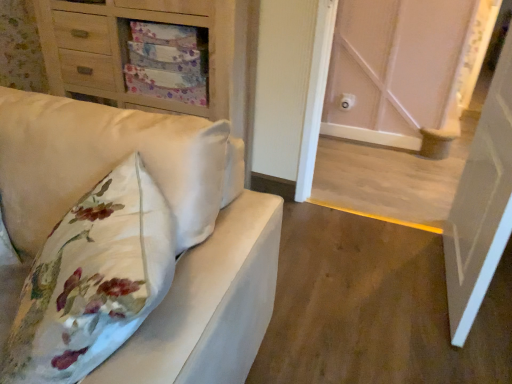
Question: From a real-world perspective, is white wood door at center, arranged as the 1th door when viewed from the back, physically located above or below white glossy door at right, which ranks as the 2th door in back-to-front order?

Choices:
 (A) above
 (B) below

Answer: (B)

Question: In the image, is white wood door at center, the second door in the front-to-back sequence, on the left side or the right side of white glossy door at right, which ranks as the 2th door in back-to-front order?

Choices:
 (A) left
 (B) right

Answer: (A)

Question: Which of these objects is positioned closest to the matte wood chest of drawers at upper left?

Choices:
 (A) white wood door at center, arranged as the 1th door when viewed from the back
 (B) matte white sofa at left
 (C) white glossy door at right, which ranks as the 2th door in back-to-front order

Answer: (B)

Question: Considering the real-world distances, which object is closest to the matte wood chest of drawers at upper left?

Choices:
 (A) white glossy door at right, which ranks as the 2th door in back-to-front order
 (B) matte white sofa at left
 (C) white wood door at center, arranged as the 1th door when viewed from the back

Answer: (B)